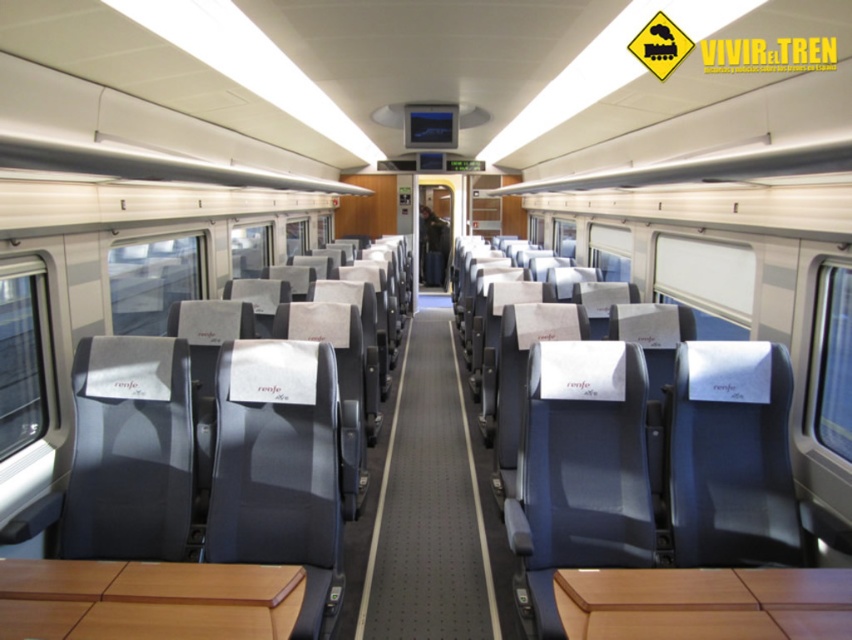
Question: Can you confirm if gray carpet at center is thinner than matte gray seat at center?

Choices:
 (A) yes
 (B) no

Answer: (A)

Question: Which object appears closest to the camera in this image?

Choices:
 (A) gray carpet at center
 (B) matte gray seat at center

Answer: (A)

Question: Is gray carpet at center wider than matte gray seat at center?

Choices:
 (A) no
 (B) yes

Answer: (A)

Question: Which of the following is the closest to the observer?

Choices:
 (A) matte gray seat at center
 (B) gray carpet at center

Answer: (B)

Question: Is gray carpet at center further to camera compared to matte gray seat at center?

Choices:
 (A) yes
 (B) no

Answer: (B)

Question: Which point is closer to the camera?

Choices:
 (A) (377, 550)
 (B) (448, 236)

Answer: (A)